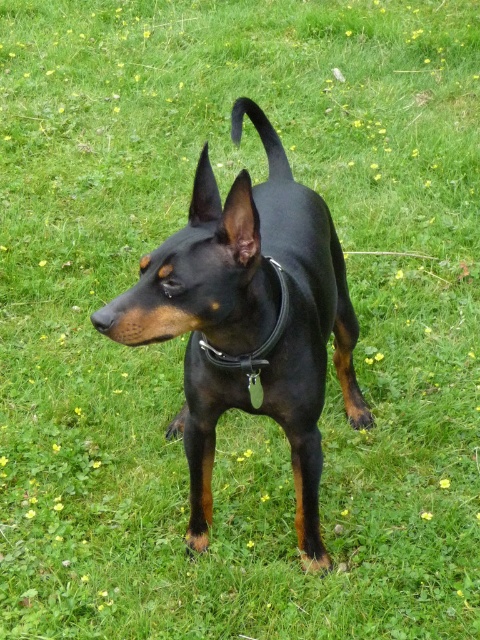
Is the position of black smooth dog at center more distant than that of black leather collar at center?

No, black smooth dog at center is in front of black leather collar at center.

Does black smooth dog at center have a lesser height compared to black leather collar at center?

No.

Where is `black smooth dog at center`? This screenshot has height=640, width=480. black smooth dog at center is located at coordinates tap(250, 321).